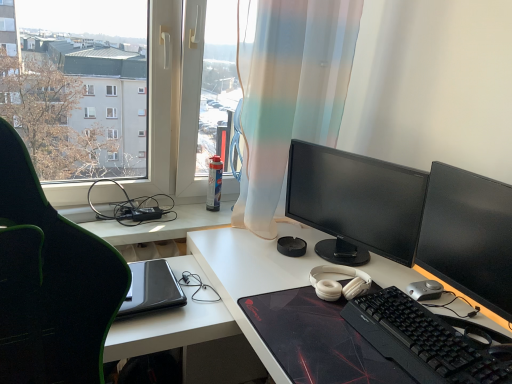
Find the location of `free point to the left of white matte headphones at center`. free point to the left of white matte headphones at center is located at coordinates (275, 268).